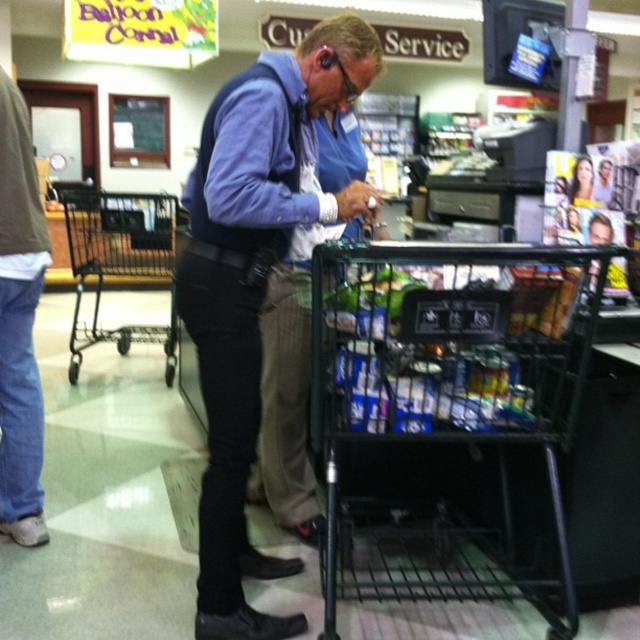
Can you confirm if matte blue shirt at center is positioned to the left of black metal shopping cart at left?

No, matte blue shirt at center is not to the left of black metal shopping cart at left.

Between matte blue shirt at center and black metal shopping cart at left, which one appears on the left side from the viewer's perspective?

From the viewer's perspective, black metal shopping cart at left appears more on the left side.

What do you see at coordinates (253, 284) in the screenshot? I see `matte blue shirt at center` at bounding box center [253, 284].

At what (x,y) coordinates should I click in order to perform the action: click on matte blue shirt at center. Please return your answer as a coordinate pair (x, y). This screenshot has width=640, height=640. Looking at the image, I should click on (253, 284).

Who is lower down, matte blue shirt at center or denim jeans at left?

matte blue shirt at center is below.

Is point (218, 509) positioned in front of point (38, 225)?

That is True.

In order to click on matte blue shirt at center in this screenshot , I will do `click(253, 284)`.

Is point (508, 276) more distant than point (80, 205)?

No, (508, 276) is closer to viewer.

Between black metal shopping cart at lower center and black metal shopping cart at left, which one is positioned higher?

black metal shopping cart at left

The height and width of the screenshot is (640, 640). Describe the element at coordinates (445, 403) in the screenshot. I see `black metal shopping cart at lower center` at that location.

Identify the location of black metal shopping cart at lower center. This screenshot has height=640, width=640. (445, 403).